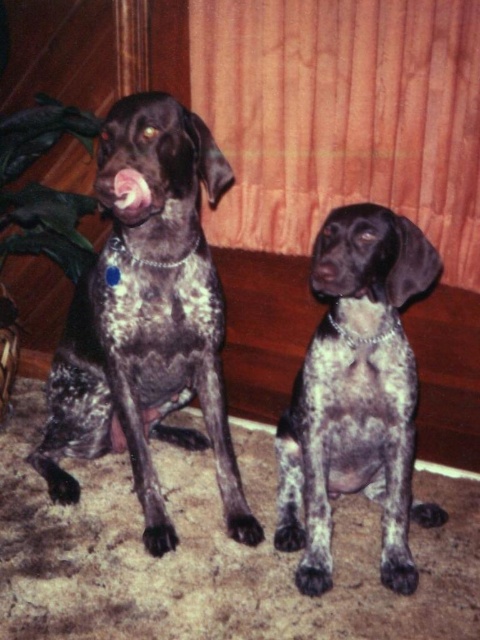
Question: Is speckled fur dog at center positioned at the back of green matte plant at left?

Choices:
 (A) no
 (B) yes

Answer: (A)

Question: From the image, what is the correct spatial relationship of speckled fur dog at left in relation to green matte plant at left?

Choices:
 (A) left
 (B) right

Answer: (B)

Question: Which object is farther from the camera taking this photo?

Choices:
 (A) speckled fur dog at left
 (B) green matte plant at left
 (C) speckled fur dog at center

Answer: (B)

Question: Which object is positioned closest to the green matte plant at left?

Choices:
 (A) speckled fur dog at left
 (B) speckled fur dog at center

Answer: (A)

Question: Which point appears closest to the camera in this image?

Choices:
 (A) (200, 125)
 (B) (9, 200)

Answer: (A)

Question: Does speckled fur dog at left appear over green matte plant at left?

Choices:
 (A) yes
 (B) no

Answer: (B)